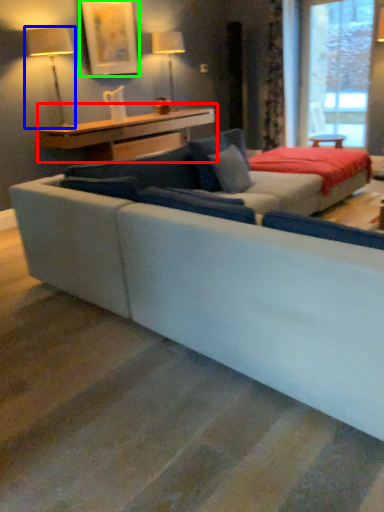
Question: Estimate the real-world distances between objects in this image. Which object is closer to table (highlighted by a red box), table lamp (highlighted by a blue box) or picture frame (highlighted by a green box)?

Choices:
 (A) table lamp
 (B) picture frame

Answer: (A)